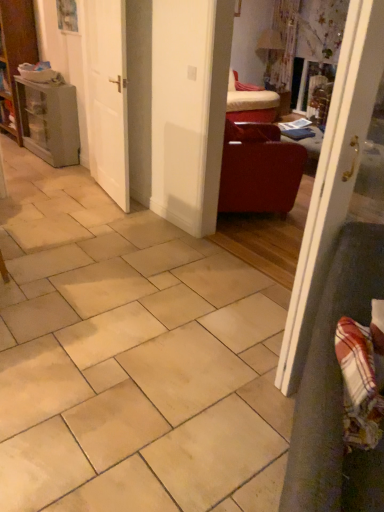
Question: From a real-world perspective, is matte leather armchair at center-right on white glossy door at right, placed as the 1th door when sorted from right to left?

Choices:
 (A) no
 (B) yes

Answer: (A)

Question: Can white glossy door at right, placed as the 1th door when sorted from right to left, be found inside matte leather armchair at center-right?

Choices:
 (A) no
 (B) yes

Answer: (A)

Question: Is matte leather armchair at center-right positioned beyond the bounds of white glossy door at right, placed as the 1th door when sorted from right to left?

Choices:
 (A) no
 (B) yes

Answer: (B)

Question: Can you confirm if matte leather armchair at center-right is thinner than white glossy door at right, which ranks as the second door in back-to-front order?

Choices:
 (A) yes
 (B) no

Answer: (B)

Question: Could you tell me if matte leather armchair at center-right is turned towards white glossy door at right, placed as the first door when sorted from front to back?

Choices:
 (A) no
 (B) yes

Answer: (A)

Question: Considering the relative positions of matte leather armchair at center-right and white glossy door at right, placed as the 1th door when sorted from right to left, in the image provided, is matte leather armchair at center-right in front of white glossy door at right, placed as the 1th door when sorted from right to left,?

Choices:
 (A) yes
 (B) no

Answer: (B)

Question: Can you confirm if white matte door at center, which ranks as the 1th door in back-to-front order, is wider than matte gray cabinet at left?

Choices:
 (A) no
 (B) yes

Answer: (A)

Question: Considering the relative sizes of white matte door at center, the second door positioned from the right, and matte gray cabinet at left in the image provided, is white matte door at center, the second door positioned from the right, taller than matte gray cabinet at left?

Choices:
 (A) no
 (B) yes

Answer: (B)

Question: Is white matte door at center, the second door positioned from the right, turned away from matte gray cabinet at left?

Choices:
 (A) yes
 (B) no

Answer: (B)

Question: Does white matte door at center, the 1th door when ordered from left to right, have a lesser height compared to matte gray cabinet at left?

Choices:
 (A) no
 (B) yes

Answer: (A)

Question: Can you confirm if white matte door at center, arranged as the 2th door when viewed from the front, is bigger than matte gray cabinet at left?

Choices:
 (A) no
 (B) yes

Answer: (A)

Question: Does white matte door at center, the second door positioned from the right, appear on the left side of matte gray cabinet at left?

Choices:
 (A) no
 (B) yes

Answer: (A)

Question: Considering the relative sizes of white glossy door at right, acting as the second door starting from the left, and matte leather armchair at center-right in the image provided, is white glossy door at right, acting as the second door starting from the left, smaller than matte leather armchair at center-right?

Choices:
 (A) no
 (B) yes

Answer: (B)